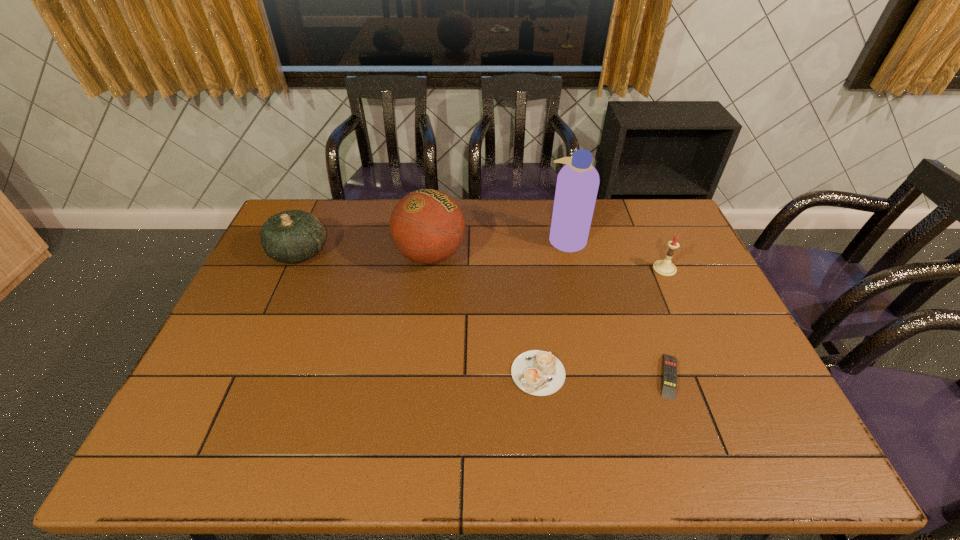
Find the location of a particular element. the fifth object from left to right is located at coordinates (669, 382).

Image resolution: width=960 pixels, height=540 pixels. In order to click on remote control in this screenshot , I will do `click(669, 382)`.

The image size is (960, 540). In order to click on vacant space located 0.230m on the front of the shampoo in this screenshot , I will do `click(581, 305)`.

You are a GUI agent. You are given a task and a screenshot of the screen. Output one action in this format:
    pyautogui.click(x=<x>, y=<y>)
    Task: Click on the free space located on the left of the second object from left to right
    
    Given the screenshot: What is the action you would take?
    pyautogui.click(x=312, y=255)

Identify the location of vacant region located on the back of the leftmost object. (314, 219).

Where is `vacant space located 0.210m on the front of the rightmost object`? The image size is (960, 540). vacant space located 0.210m on the front of the rightmost object is located at coordinates (690, 328).

Identify the location of free spot located 0.380m on the back of the fourth object from right to left. (525, 258).

This screenshot has height=540, width=960. What are the coordinates of `free region located on the front of the remote control` in the screenshot? It's located at (688, 431).

Find the location of a particular element. This screenshot has width=960, height=540. shampoo at the far edge is located at coordinates (577, 185).

This screenshot has height=540, width=960. What are the coordinates of `basketball situated at the far edge` in the screenshot? It's located at (427, 226).